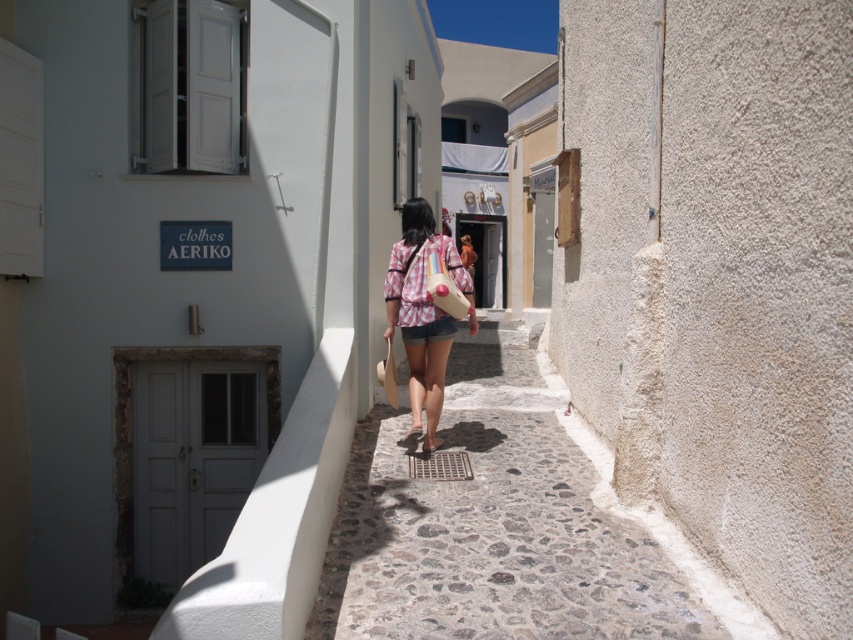
Does cobblestone alley at center appear under brown leather sandal at center?

Indeed, cobblestone alley at center is positioned under brown leather sandal at center.

The image size is (853, 640). I want to click on cobblestone alley at center, so click(492, 528).

This screenshot has width=853, height=640. Find the location of `cobblestone alley at center`. cobblestone alley at center is located at coordinates (492, 528).

Between point (403, 212) and point (434, 442), which one is positioned in front?

Positioned in front is point (434, 442).

Image resolution: width=853 pixels, height=640 pixels. Describe the element at coordinates (422, 310) in the screenshot. I see `pink plaid shirt at center` at that location.

Which is behind, point (421, 324) or point (428, 448)?

The point (428, 448) is more distant.

At what (x,y) coordinates should I click in order to perform the action: click on pink plaid shirt at center. Please return your answer as a coordinate pair (x, y). The image size is (853, 640). Looking at the image, I should click on (422, 310).

Does point (514, 326) lie in front of point (445, 332)?

No.

Who is taller, cobblestone alley at center or pink plaid shirt at center?

With more height is pink plaid shirt at center.

Does point (474, 410) come closer to viewer compared to point (430, 237)?

That is False.

Where is `cobblestone alley at center`? The image size is (853, 640). cobblestone alley at center is located at coordinates (492, 528).